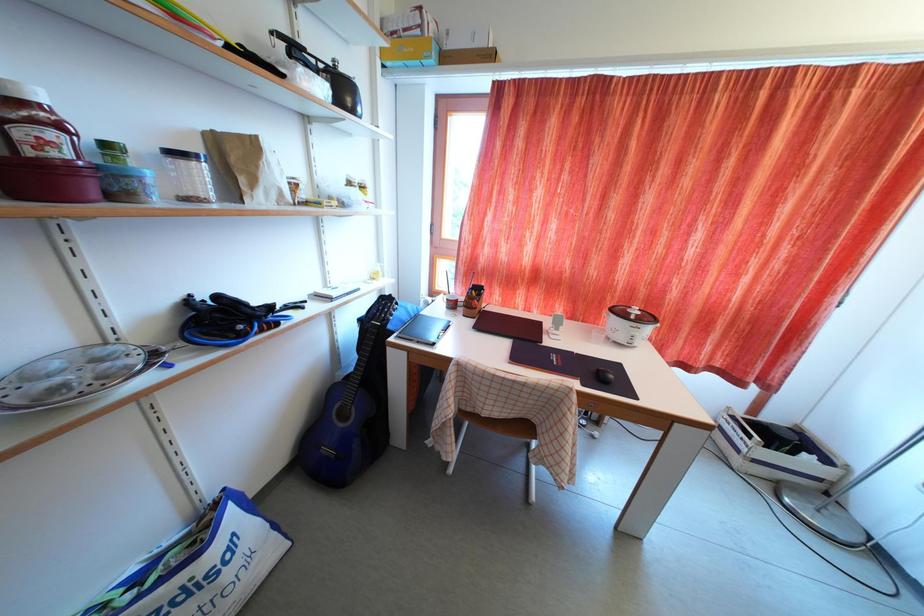
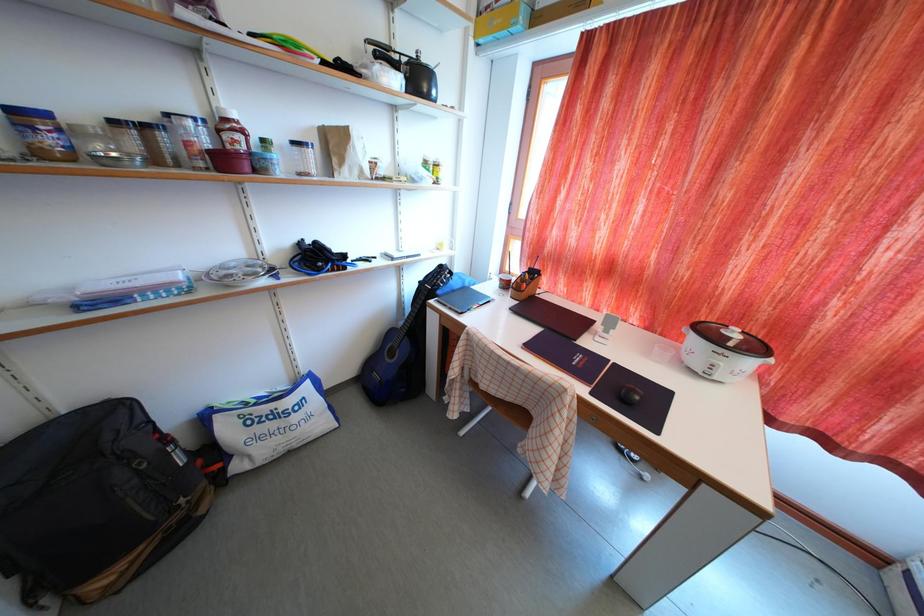
Question: What movement of the cameraman would produce the second image?

Choices:
 (A) Left
 (B) Right
 (C) Forward
 (D) Backward

Answer: (B)